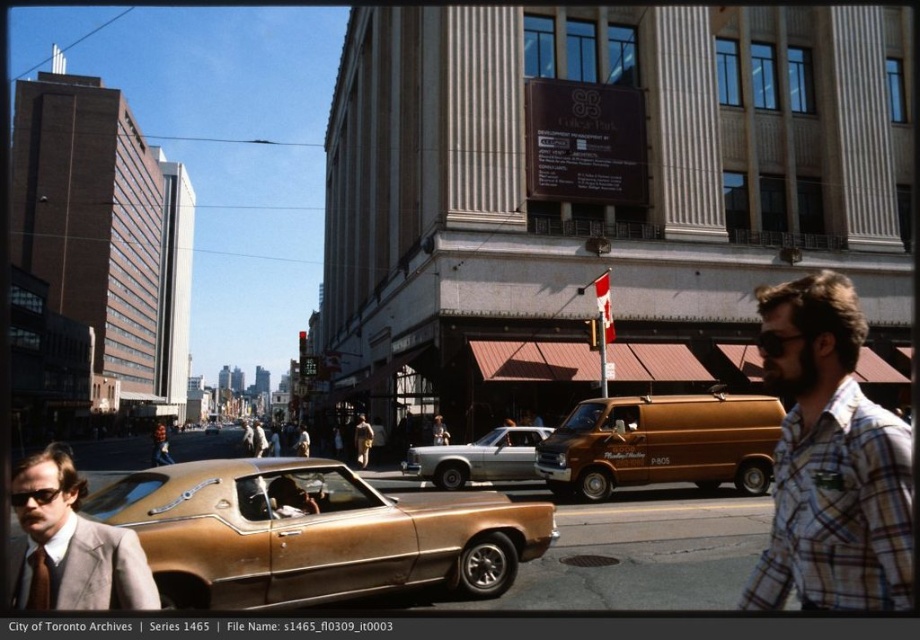
You are a photographer standing in the middle of the street. You want to take a photo of the light brown suit at left and the matte black sunglasses at lower left. Which object should you focus on first to ensure both are in sharp focus?

The light brown suit at left is closer to the viewer than the matte black sunglasses at lower left. To ensure both are in sharp focus, you should focus on the light brown suit at left first, as it is closer, and the matte black sunglasses at lower left will fall within the depth of field if the focus is set properly.